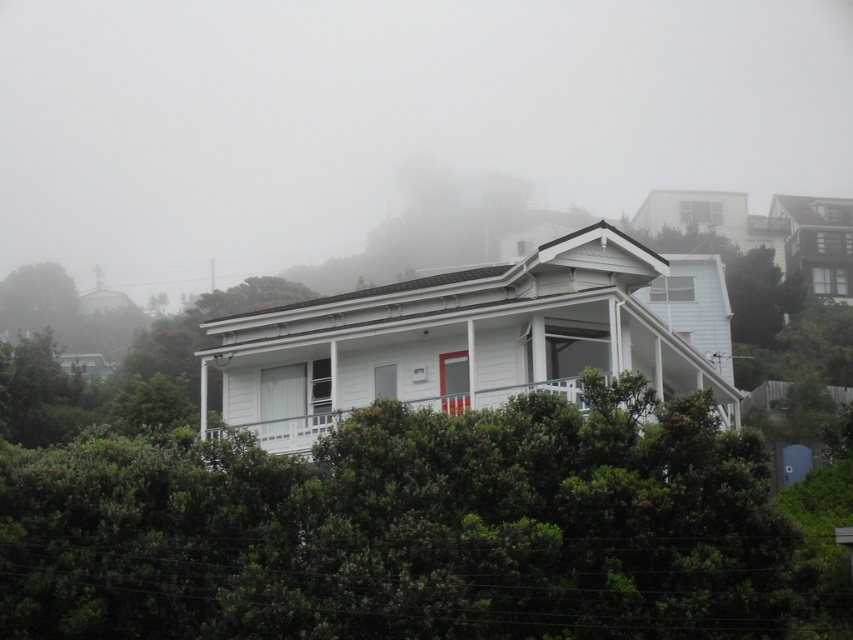
You are standing at the point marked by the coordinates point (387, 118) in the image. What can you see directly in front of you?

The point (387, 118) indicates foggy white house at center, so you can see the foggy white house at center directly in front of you.

From the picture: You are standing on the front yard of the foggy white house at center. You want to walk to the white painted wood porch at center. Which direction should you move towards?

The foggy white house at center is to the left of the white painted wood porch at center, so you should move to the right to reach the white painted wood porch at center.